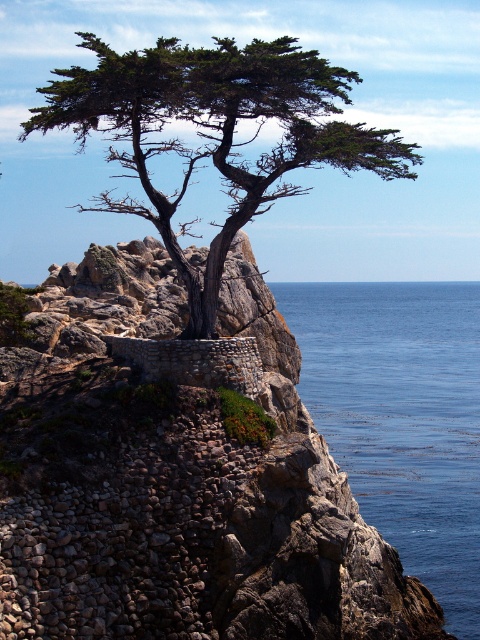
Question: Which point appears closest to the camera in this image?

Choices:
 (A) (84, 134)
 (B) (446, 372)

Answer: (A)

Question: Is the position of blue liquid water at lower right more distant than that of green textured cypress tree at center?

Choices:
 (A) yes
 (B) no

Answer: (A)

Question: Can you confirm if blue liquid water at lower right is positioned above green textured cypress tree at center?

Choices:
 (A) no
 (B) yes

Answer: (A)

Question: Among these objects, which one is nearest to the camera?

Choices:
 (A) green textured cypress tree at center
 (B) blue liquid water at lower right

Answer: (A)

Question: Is blue liquid water at lower right closer to the viewer compared to green textured cypress tree at center?

Choices:
 (A) no
 (B) yes

Answer: (A)